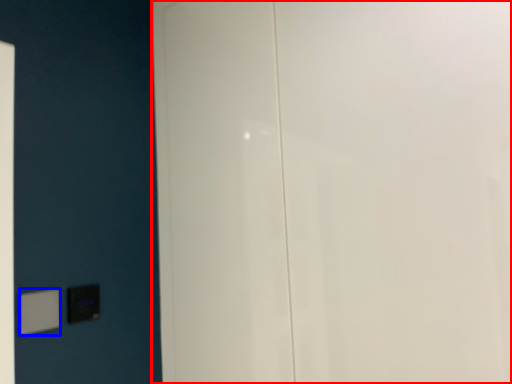
Question: Which object is further to the camera taking this photo, door (highlighted by a red box) or light switch (highlighted by a blue box)?

Choices:
 (A) door
 (B) light switch

Answer: (B)